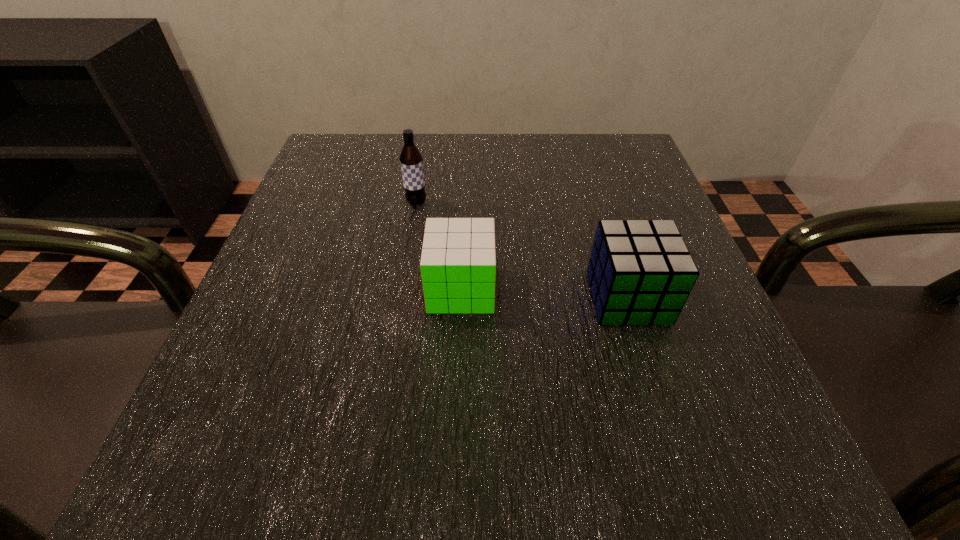
The height and width of the screenshot is (540, 960). I want to click on vacant space at the left edge of the desktop, so click(x=265, y=375).

This screenshot has height=540, width=960. I want to click on blank space at the right edge of the desktop, so click(606, 220).

Identify the location of vacant space at the far right corner of the desktop. This screenshot has height=540, width=960. (597, 163).

Where is `free space between the rightmost object and the second object from right to left`? Image resolution: width=960 pixels, height=540 pixels. free space between the rightmost object and the second object from right to left is located at coordinates (544, 293).

The image size is (960, 540). I want to click on free spot between the rightmost object and the left cube, so click(x=544, y=293).

Identify the location of vacant region between the rightmost object and the left cube. This screenshot has width=960, height=540. (544, 293).

You are a GUI agent. You are given a task and a screenshot of the screen. Output one action in this format:
    pyautogui.click(x=<x>, y=<y>)
    Task: Click on the free spot between the right cube and the left cube
    
    Given the screenshot: What is the action you would take?
    pyautogui.click(x=544, y=293)

I want to click on free area in between the right cube and the second object from right to left, so click(544, 293).

Where is `vacant space that is in between the rightmost object and the left cube`? vacant space that is in between the rightmost object and the left cube is located at coordinates (544, 293).

Image resolution: width=960 pixels, height=540 pixels. Find the location of `free area in between the farthest object and the right cube`. free area in between the farthest object and the right cube is located at coordinates (522, 251).